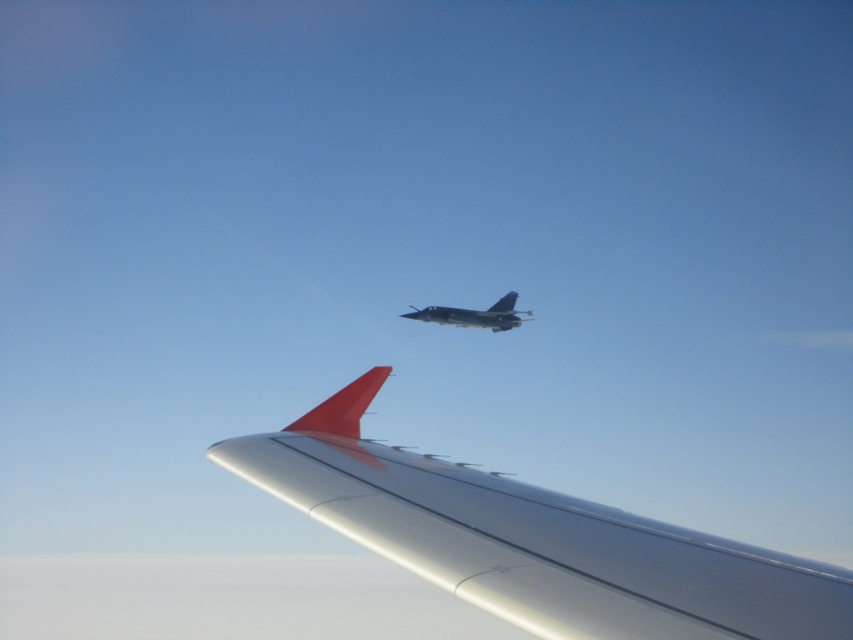
Is point (253, 464) more distant than point (515, 292)?

No.

Does silver metallic wing at upper center appear on the left side of shiny metallic jet at center?

Correct, you'll find silver metallic wing at upper center to the left of shiny metallic jet at center.

Is point (601, 625) closer to viewer compared to point (514, 296)?

Yes, point (601, 625) is closer to viewer.

Locate an element on the screen. This screenshot has height=640, width=853. silver metallic wing at upper center is located at coordinates (534, 540).